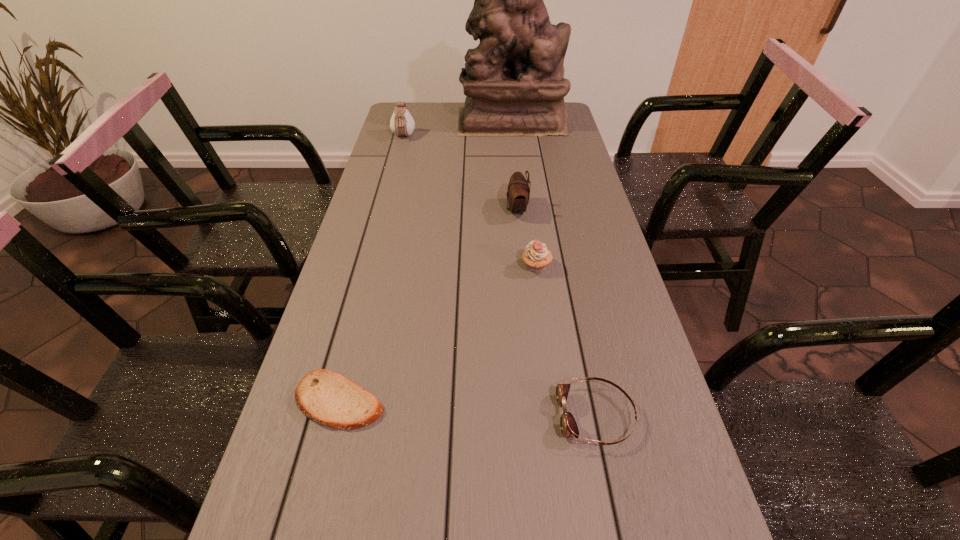
Locate an element on the screen. This screenshot has width=960, height=540. free space between the fourth tallest object and the right pouch is located at coordinates (527, 238).

Locate an element on the screen. This screenshot has width=960, height=540. free space between the pita bread and the tallest object is located at coordinates (425, 260).

Locate an element on the screen. free space between the third shortest object and the pita bread is located at coordinates (438, 333).

This screenshot has height=540, width=960. I want to click on free space between the sculpture and the nearer pouch, so click(514, 165).

Where is `free space between the third farthest object and the left pouch`? The height and width of the screenshot is (540, 960). free space between the third farthest object and the left pouch is located at coordinates (460, 173).

What are the coordinates of `vacant space that's between the right pouch and the third shortest object` in the screenshot? It's located at (527, 238).

At what (x,y) coordinates should I click in order to perform the action: click on empty location between the goggles and the farther pouch. Please return your answer as a coordinate pair (x, y). Looking at the image, I should click on [499, 276].

The height and width of the screenshot is (540, 960). What are the coordinates of `vacant area between the farther pouch and the tallest object` in the screenshot? It's located at (457, 129).

At what (x,y) coordinates should I click in order to perform the action: click on free spot between the goggles and the farther pouch. Please return your answer as a coordinate pair (x, y). Looking at the image, I should click on (499, 276).

Identify the location of free space between the goggles and the cupcake. (566, 341).